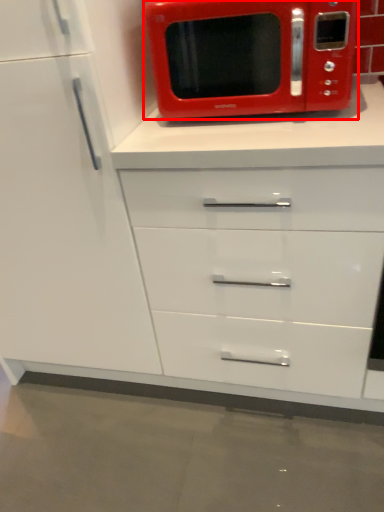
Question: Observing the image, what is the correct spatial positioning of microwave oven (annotated by the red box) in reference to cabinetry?

Choices:
 (A) right
 (B) left

Answer: (A)